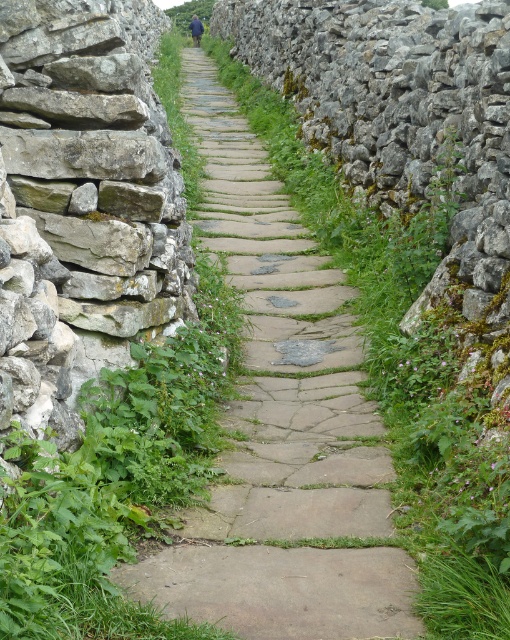
You are standing at the entrance of the pathway and want to take a photo of the rough stone wall at left. Which direction should you face to capture it in your shot?

The rough stone wall at left is located at point (83, 204), so you should face to the left side of the pathway to capture it in your shot.

You are standing on the narrow stone pathway and want to reach the green leafy grass at center. Which direction should you move to get there from the rough stone wall at left?

To reach the green leafy grass at center from the rough stone wall at left, you should move to the right, as the green leafy grass at center is located to the right of the rough stone wall at left according to the description.

Consider the image. You are standing on the narrow stone pathway and notice a specific point marked at coordinates (83, 204). Based on the scene description, what object does this point most likely belong to?

The point at coordinates (83, 204) corresponds to the rough stone wall at left.